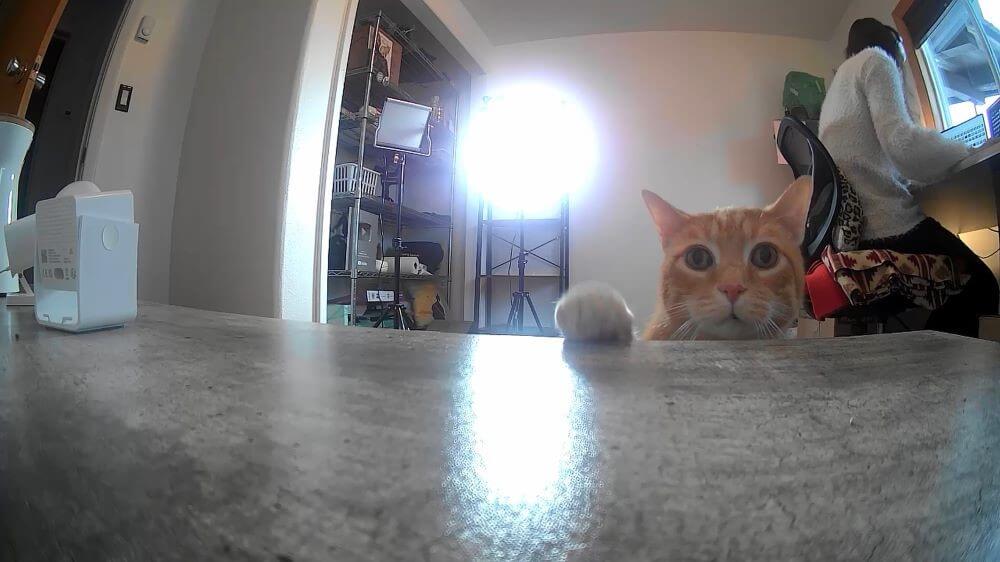
You are a GUI agent. You are given a task and a screenshot of the screen. Output one action in this format:
    pyautogui.click(x=<x>, y=<y>)
    Task: Click on the blankets
    This screenshot has width=1000, height=562.
    Given the screenshot: What is the action you would take?
    pyautogui.click(x=829, y=294), pyautogui.click(x=878, y=271)